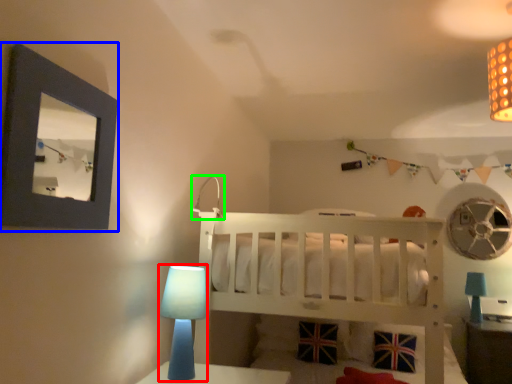
Question: Estimate the real-world distances between objects in this image. Which object is closer to table lamp (highlighted by a red box), picture frame (highlighted by a blue box) or lamp (highlighted by a green box)?

Choices:
 (A) picture frame
 (B) lamp

Answer: (B)